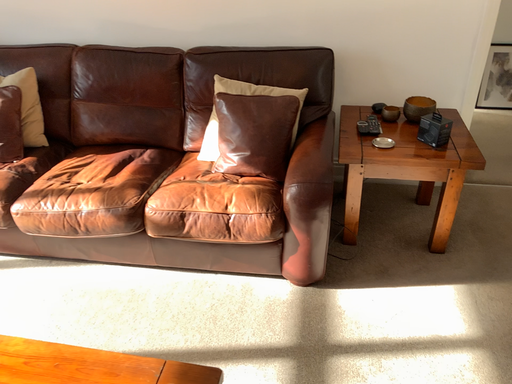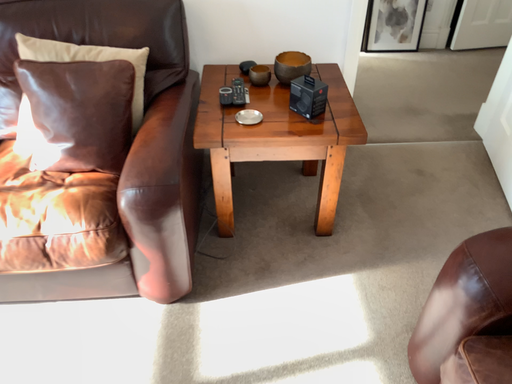
Question: Which way did the camera rotate in the video?

Choices:
 (A) rotated downward
 (B) rotated upward

Answer: (A)